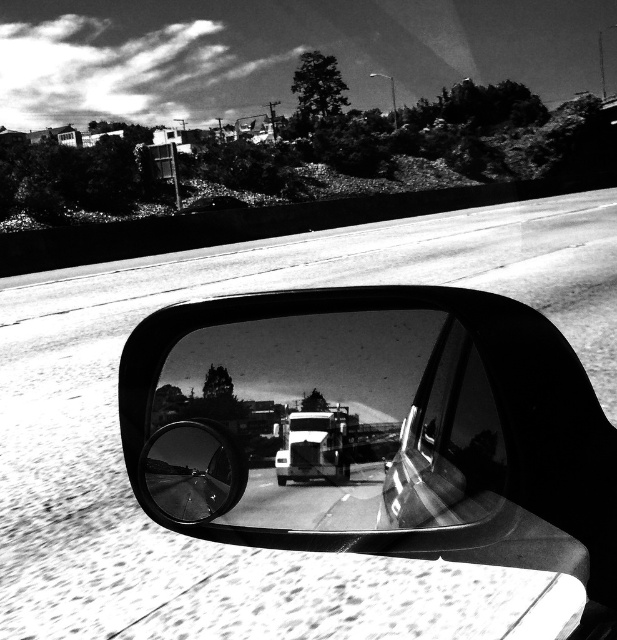
Question: Is polished chrome car window at center positioned in front of metallic silver trailer truck at center?

Choices:
 (A) no
 (B) yes

Answer: (B)

Question: Is polished chrome car window at center positioned behind shiny chrome mirror at center?

Choices:
 (A) no
 (B) yes

Answer: (A)

Question: Among these objects, which one is nearest to the camera?

Choices:
 (A) metallic silver trailer truck at center
 (B) polished chrome car window at center

Answer: (B)

Question: Can you confirm if polished chrome car window at center is wider than shiny chrome mirror at center?

Choices:
 (A) no
 (B) yes

Answer: (B)

Question: Which object is positioned farthest from the polished chrome car window at center?

Choices:
 (A) shiny chrome mirror at center
 (B) metallic silver trailer truck at center

Answer: (A)

Question: Which point is farther from the camera taking this photo?

Choices:
 (A) (299, 465)
 (B) (193, 468)

Answer: (B)